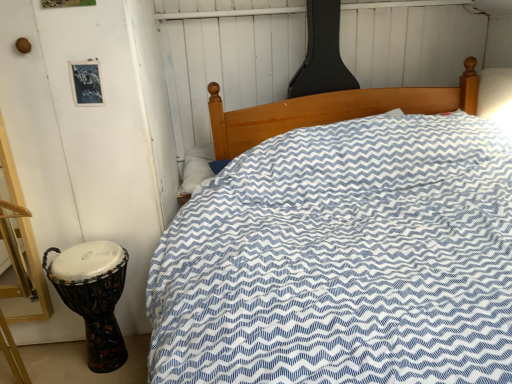
Question: From the image's perspective, is white soft pillow at center above or below multicolored fabric drum at left?

Choices:
 (A) below
 (B) above

Answer: (B)

Question: Is white soft pillow at center in front of or behind multicolored fabric drum at left in the image?

Choices:
 (A) front
 (B) behind

Answer: (B)

Question: Is white soft pillow at center wider or thinner than multicolored fabric drum at left?

Choices:
 (A) wide
 (B) thin

Answer: (B)

Question: Considering their positions, is multicolored fabric drum at left located in front of or behind white soft pillow at center?

Choices:
 (A) front
 (B) behind

Answer: (A)

Question: Considering the positions of multicolored fabric drum at left and white soft pillow at center in the image, is multicolored fabric drum at left taller or shorter than white soft pillow at center?

Choices:
 (A) tall
 (B) short

Answer: (A)

Question: Looking at the image, does multicolored fabric drum at left seem bigger or smaller compared to white soft pillow at center?

Choices:
 (A) big
 (B) small

Answer: (A)

Question: From a real-world perspective, is multicolored fabric drum at left above or below white soft pillow at center?

Choices:
 (A) above
 (B) below

Answer: (B)